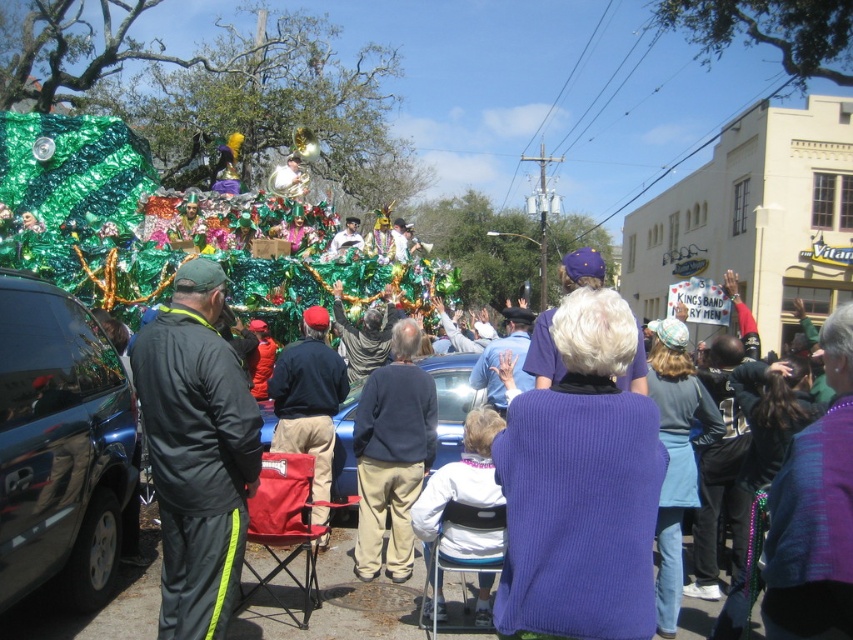
Is point (489, 292) closer to viewer compared to point (467, 365)?

No.

I want to click on green shiny tinsel at center, so click(x=483, y=248).

Between point (463, 257) and point (468, 401), which one is positioned behind?

Positioned behind is point (463, 257).

Find the location of `green shiny tinsel at center`. green shiny tinsel at center is located at coordinates (483, 248).

Is purple ribbed sweater at center shorter than dark blue sweater at center?

No, purple ribbed sweater at center is not shorter than dark blue sweater at center.

Between purple ribbed sweater at center and dark blue sweater at center, which one is positioned lower?

dark blue sweater at center is lower down.

Does point (625, 460) come farther from viewer compared to point (425, 376)?

No, (625, 460) is in front of (425, 376).

This screenshot has height=640, width=853. I want to click on purple ribbed sweater at center, so click(x=579, y=486).

Is black fabric jacket at left below blue metallic car at center?

No, black fabric jacket at left is not below blue metallic car at center.

Who is positioned more to the right, black fabric jacket at left or blue metallic car at center?

blue metallic car at center is more to the right.

Does point (227, 477) come closer to viewer compared to point (456, 403)?

Yes, point (227, 477) is closer to viewer.

At what (x,y) coordinates should I click in order to perform the action: click on black fabric jacket at left. Please return your answer as a coordinate pair (x, y). Image resolution: width=853 pixels, height=640 pixels. Looking at the image, I should click on [x=196, y=451].